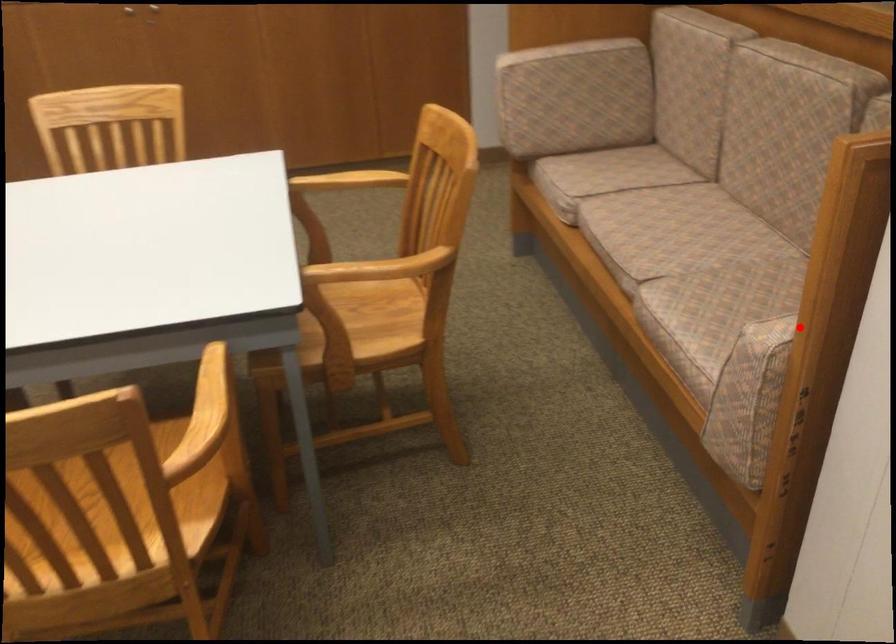
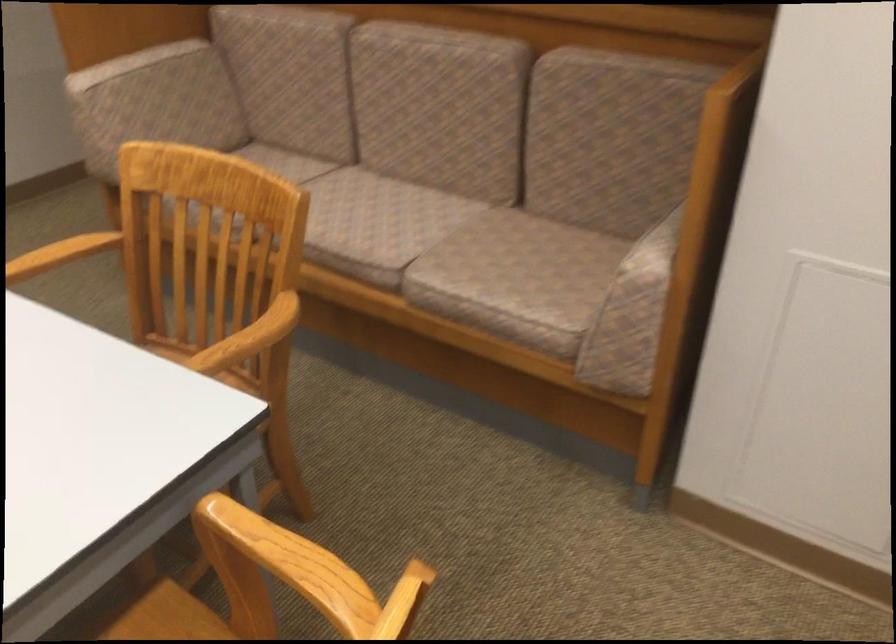
Question: A red point is marked in image1. In image2, is the corresponding 3D point closer to the camera or farther? Reply with the corresponding letter.

Choices:
 (A) The corresponding 3D point is closer.
 (B) The corresponding 3D point is farther.

Answer: (B)